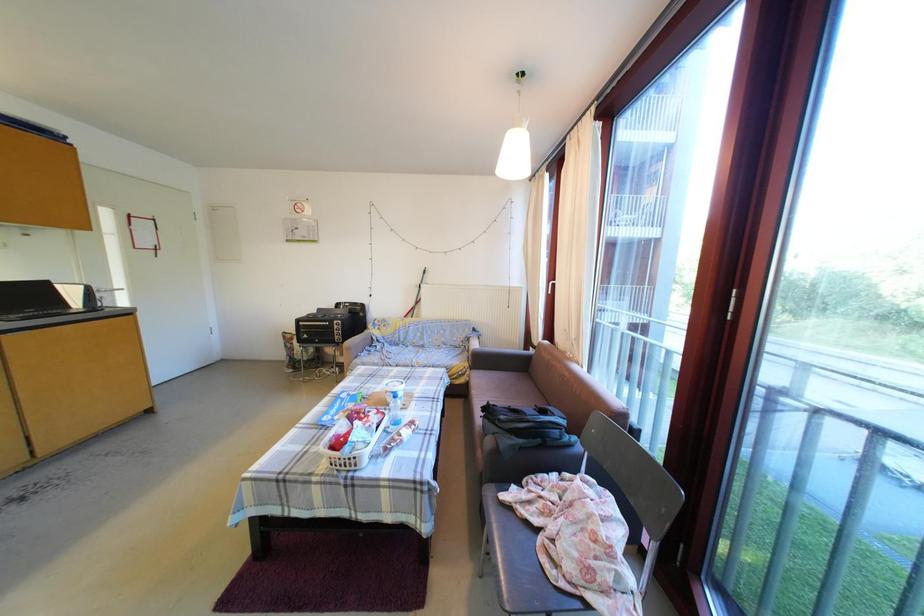
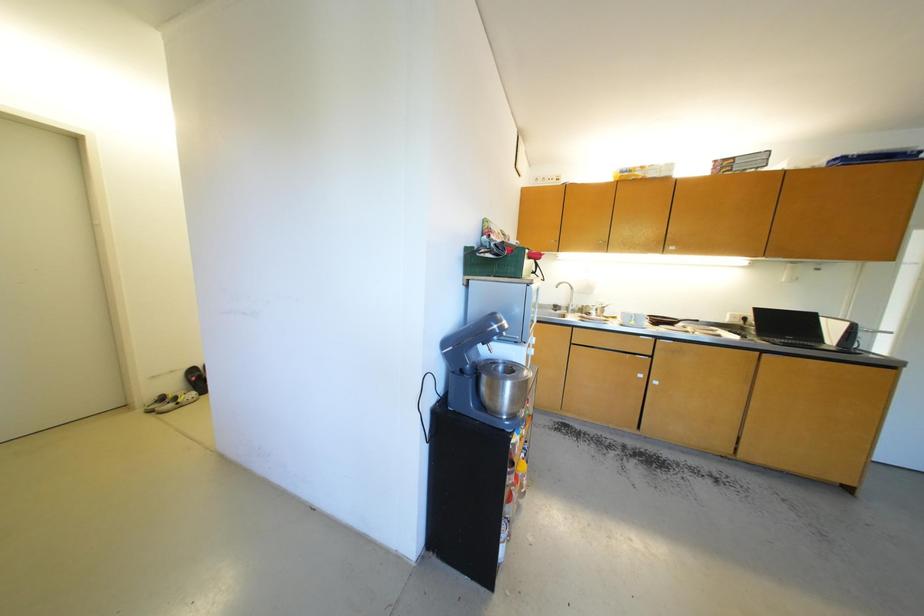
Question: The images are taken continuously from a first-person perspective. In which direction is your viewpoint rotating?

Choices:
 (A) Left
 (B) Right
 (C) Up
 (D) Down

Answer: (A)